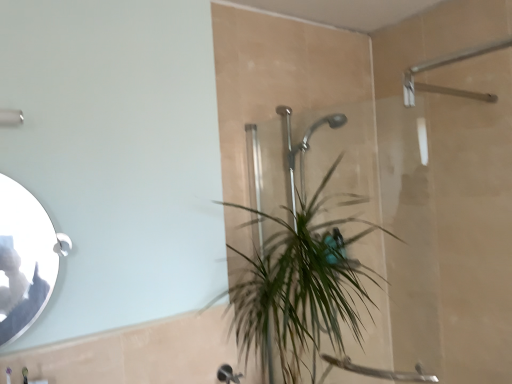
Question: From a real-world perspective, is green leafy plant at center over silver/metallic mirror at left?

Choices:
 (A) yes
 (B) no

Answer: (B)

Question: From the image's perspective, is green leafy plant at center above silver/metallic mirror at left?

Choices:
 (A) yes
 (B) no

Answer: (B)

Question: Does green leafy plant at center have a lesser height compared to silver/metallic mirror at left?

Choices:
 (A) yes
 (B) no

Answer: (B)

Question: Is green leafy plant at center smaller than silver/metallic mirror at left?

Choices:
 (A) no
 (B) yes

Answer: (A)

Question: Is silver/metallic mirror at left completely or partially inside green leafy plant at center?

Choices:
 (A) no
 (B) yes

Answer: (A)

Question: Is green leafy plant at center not near silver/metallic mirror at left?

Choices:
 (A) no
 (B) yes

Answer: (A)

Question: Is silver/metallic mirror at left to the right of green leafy plant at center from the viewer's perspective?

Choices:
 (A) no
 (B) yes

Answer: (A)

Question: Does silver/metallic mirror at left have a lesser width compared to green leafy plant at center?

Choices:
 (A) yes
 (B) no

Answer: (A)

Question: Is green leafy plant at center surrounded by silver/metallic mirror at left?

Choices:
 (A) no
 (B) yes

Answer: (A)

Question: Is silver/metallic mirror at left oriented towards green leafy plant at center?

Choices:
 (A) no
 (B) yes

Answer: (A)

Question: Is silver/metallic mirror at left turned away from green leafy plant at center?

Choices:
 (A) yes
 (B) no

Answer: (B)

Question: Is the position of silver/metallic mirror at left more distant than that of green leafy plant at center?

Choices:
 (A) yes
 (B) no

Answer: (B)

Question: Is silver/metallic mirror at left to the left of matte silver shower at upper left from the viewer's perspective?

Choices:
 (A) no
 (B) yes

Answer: (A)